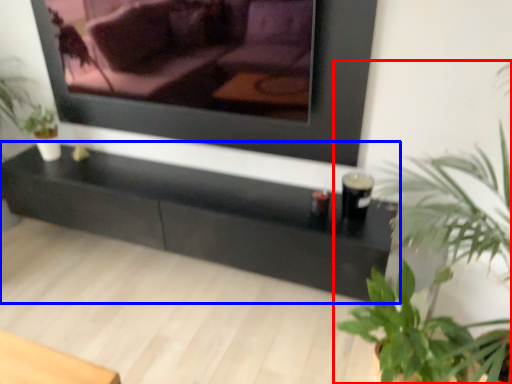
Question: Among these objects, which one is farthest to the camera, houseplant (highlighted by a red box) or table (highlighted by a blue box)?

Choices:
 (A) houseplant
 (B) table

Answer: (B)